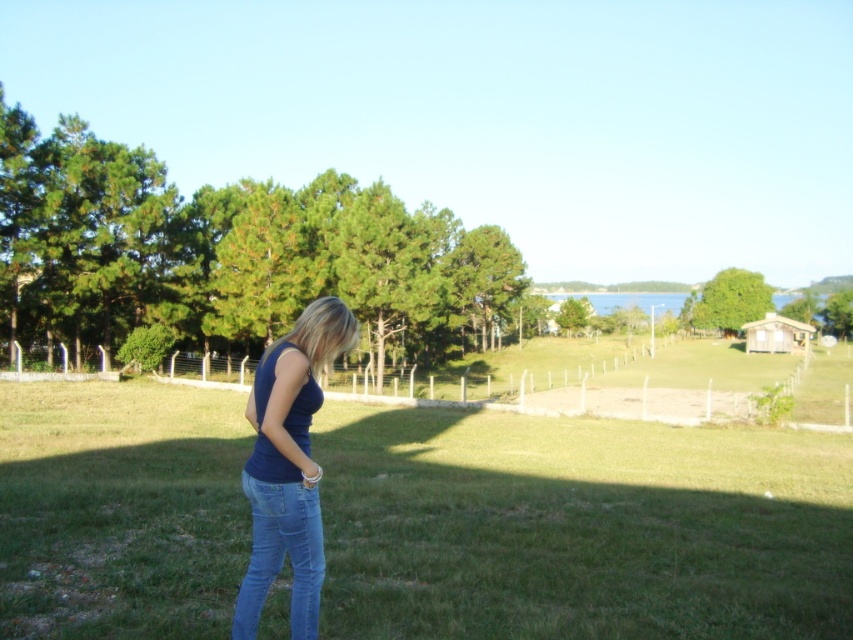
Question: Observing the image, what is the correct spatial positioning of green grass at center in reference to matte blue tank top at center?

Choices:
 (A) above
 (B) below

Answer: (B)

Question: Which point appears farthest from the camera in this image?

Choices:
 (A) (344, 529)
 (B) (254, 572)
 (C) (294, 561)

Answer: (A)

Question: Estimate the real-world distances between objects in this image. Which object is farther from the blue denim jeans at center?

Choices:
 (A) green grass at center
 (B) matte blue tank top at center

Answer: (A)

Question: Is matte blue tank top at center thinner than blue denim jeans at center?

Choices:
 (A) yes
 (B) no

Answer: (B)

Question: Is matte blue tank top at center to the left of blue denim jeans at center from the viewer's perspective?

Choices:
 (A) no
 (B) yes

Answer: (B)

Question: Which point is farther to the camera?

Choices:
 (A) (294, 520)
 (B) (566, 506)
 (C) (251, 480)

Answer: (B)